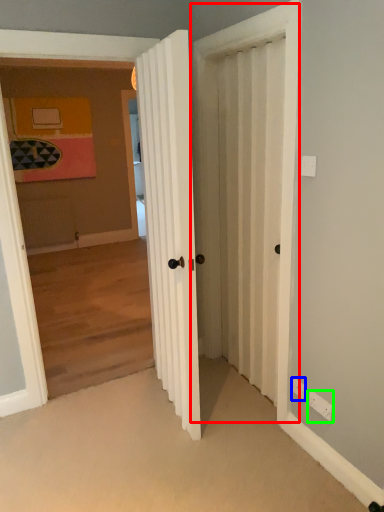
Question: Which object is positioned farthest from screen door (highlighted by a red box)? Select from electric outlet (highlighted by a blue box) and electric outlet (highlighted by a green box).

Choices:
 (A) electric outlet
 (B) electric outlet

Answer: (A)